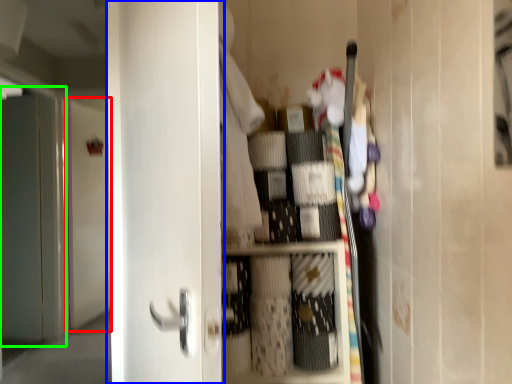
Question: Which object is the farthest from door (highlighted by a red box)? Choose among these: door (highlighted by a blue box) or screen door (highlighted by a green box).

Choices:
 (A) door
 (B) screen door

Answer: (A)